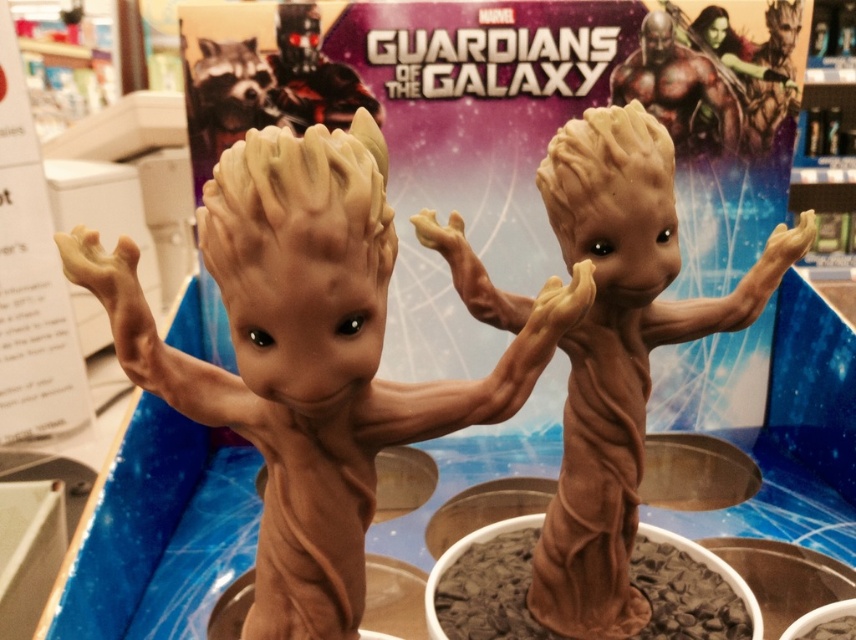
From the picture: Can you confirm if matte black figure at upper center is bigger than shiny metallic raccoon at upper left?

Yes, matte black figure at upper center is bigger than shiny metallic raccoon at upper left.

Is point (334, 99) closer to camera compared to point (248, 51)?

No, (334, 99) is behind (248, 51).

Where is `matte black figure at upper center`? The width and height of the screenshot is (856, 640). matte black figure at upper center is located at coordinates (312, 74).

Between point (250, 381) and point (316, 112), which one is positioned behind?

Positioned behind is point (316, 112).

Which is more to the left, brown rubbery tree-like figure at center or matte black figure at upper center?

Positioned to the left is matte black figure at upper center.

Locate an element on the screen. The image size is (856, 640). brown rubbery tree-like figure at center is located at coordinates (308, 355).

This screenshot has height=640, width=856. Describe the element at coordinates (308, 355) in the screenshot. I see `brown rubbery tree-like figure at center` at that location.

Between brown rubbery tree-like figure at center and brown rubber groot at upper right, which one has more height?

Standing taller between the two is brown rubbery tree-like figure at center.

Does point (296, 557) come behind point (642, 24)?

No.

What are the coordinates of `brown rubbery tree-like figure at center` in the screenshot? It's located at (308, 355).